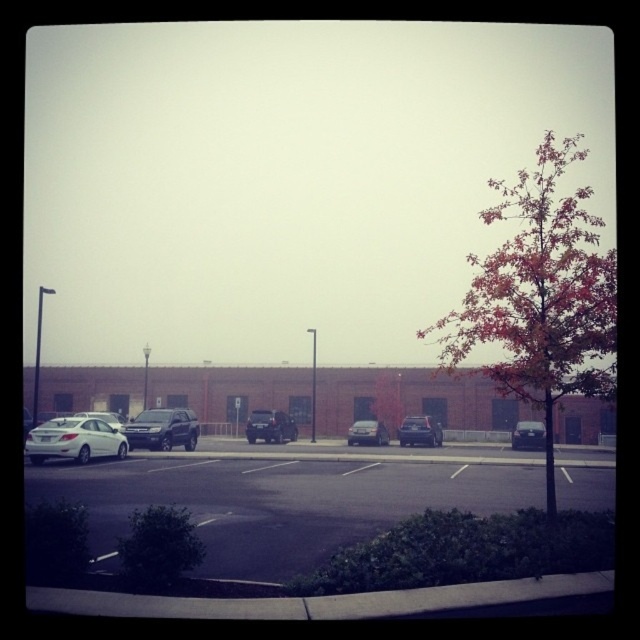
You are a delivery person trying to park a delivery van that is 2 meters wide. You see the shiny black suv at center and the satin black sedan at center in the parking lot. Can you determine if there is enough space between them to park your van?

The shiny black suv at center might be wider than satin black sedan at center, so the space between them may not be sufficient for a 2 meter wide van. Check the actual width before deciding.

You are standing at the center of the parking lot and want to park your car. There is a white matte sedan at left at point (74,440). Is there enough space between the white matte sedan at left and the hedge to park your car?

The white matte sedan at left is located at point (74,440). Without specific distance information between the sedan and the hedge, it is impossible to determine if there is enough space to park. Please provide more details about the distance or spacing between these objects.

Looking at this image, you are a delivery person trying to park your van, which is 6 feet tall. You see the shiny black suv at center and the satin black sedan at center in the parking lot. Can your van fit between them if there is a 7 feet gap between them?

The shiny black suv at center is taller than the satin black sedan at center. Since the gap between them is 7 feet and your van is 6 feet tall, your van can fit between them as it is shorter than the available vertical space.